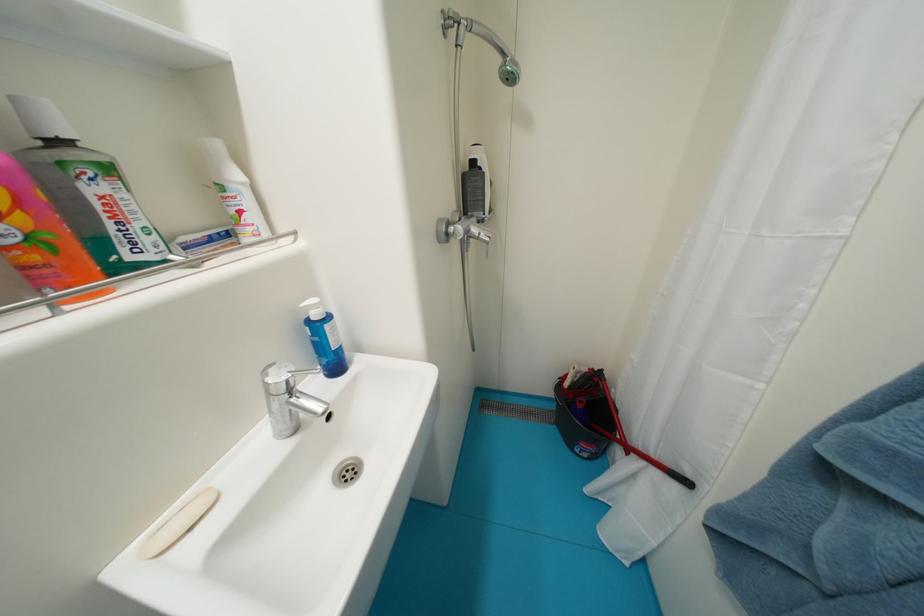
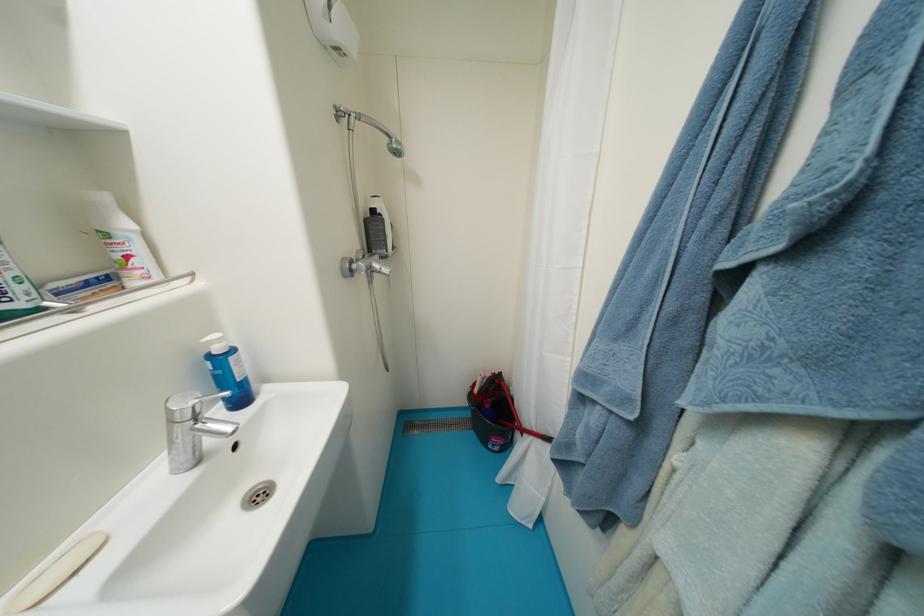
In the second image, find the point that corresponds to point (590, 371) in the first image.

(495, 377)